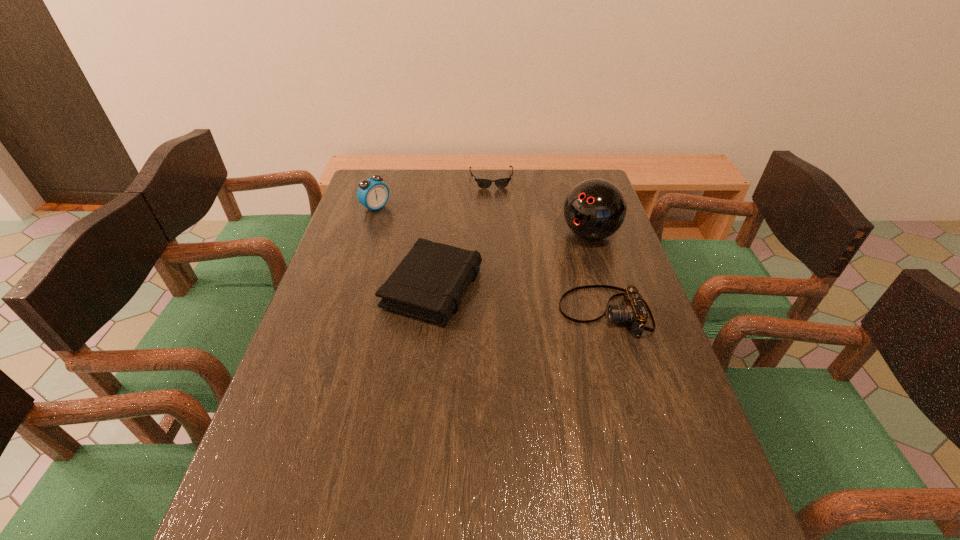
The width and height of the screenshot is (960, 540). I want to click on vacant space on the desktop that is between the Bible and the camera and is positioned on the surface of the bowling ball near the finger holes, so click(505, 296).

Where is `free spot on the desktop that is between the Bible and the camera and is positioned on the front-facing side of the shortest object`? The image size is (960, 540). free spot on the desktop that is between the Bible and the camera and is positioned on the front-facing side of the shortest object is located at coordinates (509, 297).

This screenshot has height=540, width=960. What are the coordinates of `vacant spot on the desktop that is between the Bible and the camera and is positioned on the face of the alarm clock` in the screenshot? It's located at (520, 299).